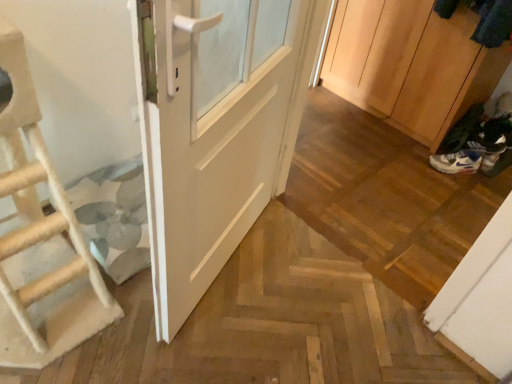
I want to click on vacant space to the right of white matte door at center, so click(311, 290).